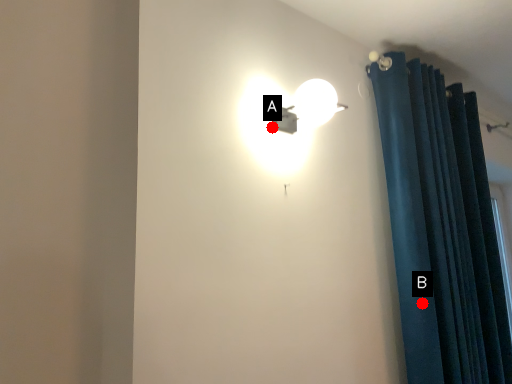
Question: Two points are circled on the image, labeled by A and B beside each circle. Among these points, which one is farthest from the camera?

Choices:
 (A) A is further
 (B) B is further

Answer: (B)